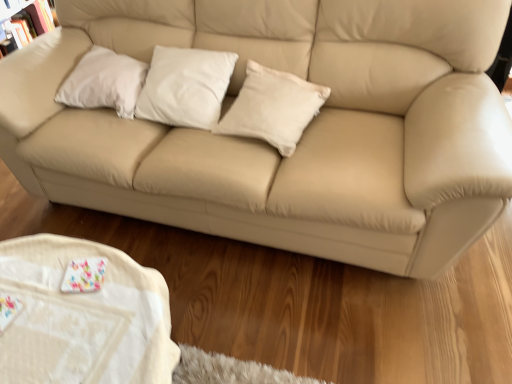
Question: Is white cotton pillow at center, which is counted as the first pillow, starting from the right, wider or thinner than white matte pillow at upper left, which ranks as the 1th pillow in left-to-right order?

Choices:
 (A) thin
 (B) wide

Answer: (B)

Question: Is white cotton pillow at center, placed as the third pillow when sorted from left to right, in front of or behind white matte pillow at upper left, which ranks as the third pillow in right-to-left order, in the image?

Choices:
 (A) front
 (B) behind

Answer: (A)

Question: Which of these objects is positioned closest to the white matte pillow at center, which is the 2th pillow in right-to-left order?

Choices:
 (A) white cotton pillow at center, placed as the third pillow when sorted from left to right
 (B) white matte pillow at upper left, which ranks as the third pillow in right-to-left order
 (C) beige leather couch at center
 (D) white fabric table at lower left
 (E) matte white bookcase at upper left

Answer: (B)

Question: Which object is positioned farthest from the white matte pillow at upper left, which ranks as the 1th pillow in left-to-right order?

Choices:
 (A) white fabric table at lower left
 (B) white matte pillow at center, which is the 2th pillow in right-to-left order
 (C) matte white bookcase at upper left
 (D) white cotton pillow at center, which is counted as the first pillow, starting from the right
 (E) beige leather couch at center

Answer: (C)